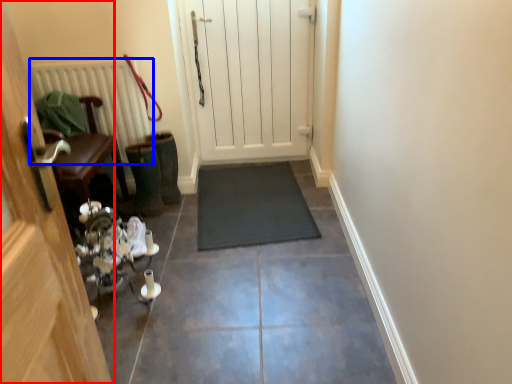
Question: Which of the following is the closest to the observer, door (highlighted by a red box) or radiator (highlighted by a blue box)?

Choices:
 (A) door
 (B) radiator

Answer: (A)